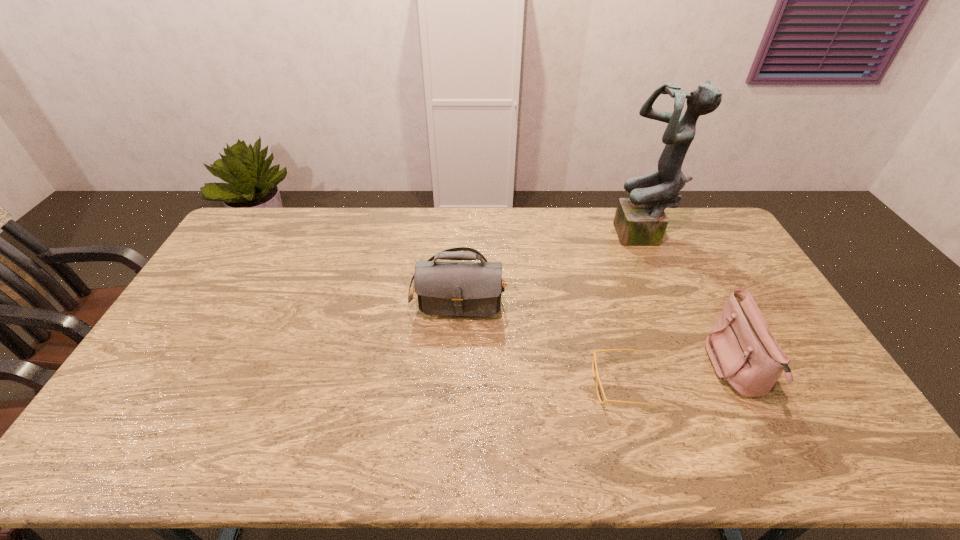
In the image, there is a desktop. At what (x,y) coordinates should I click in order to perform the action: click on vacant area at the left edge. Please return your answer as a coordinate pair (x, y). The height and width of the screenshot is (540, 960). Looking at the image, I should click on (165, 407).

Where is `free space at the far left corner of the desktop`? free space at the far left corner of the desktop is located at coordinates (232, 235).

Image resolution: width=960 pixels, height=540 pixels. Identify the location of free space at the near right corner of the desktop. (877, 456).

You are a GUI agent. You are given a task and a screenshot of the screen. Output one action in this format:
    pyautogui.click(x=<x>, y=<y>)
    Task: Click on the free space between the shortest object and the tallest object
    The image size is (960, 540).
    Given the screenshot: What is the action you would take?
    pyautogui.click(x=633, y=311)

Where is `free point between the shortest object and the sculpture`? This screenshot has height=540, width=960. free point between the shortest object and the sculpture is located at coordinates click(633, 311).

I want to click on vacant area that lies between the tallest object and the spectacles, so click(633, 311).

Find the location of a particular element. free space between the shorter shoulder bag and the third object from right to left is located at coordinates (679, 377).

I want to click on empty location between the nearer shoulder bag and the sculpture, so click(690, 303).

Identify the location of vacant area between the third object from right to left and the sculpture. The image size is (960, 540). (633, 311).

You are a GUI agent. You are given a task and a screenshot of the screen. Output one action in this format:
    pyautogui.click(x=<x>, y=<y>)
    Task: Click on the free space between the nearer shoulder bag and the tallest object
    The height and width of the screenshot is (540, 960).
    Given the screenshot: What is the action you would take?
    pyautogui.click(x=690, y=303)